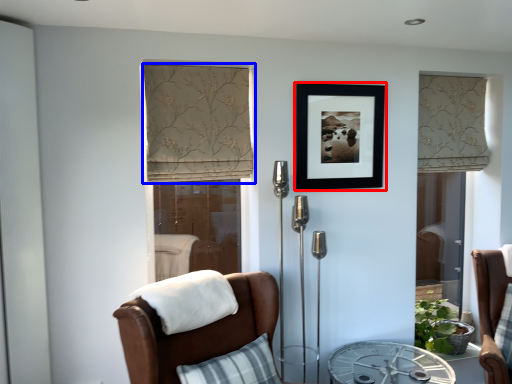
Question: Which object appears closest to the camera in this image, picture frame (highlighted by a red box) or curtain (highlighted by a blue box)?

Choices:
 (A) picture frame
 (B) curtain

Answer: (B)